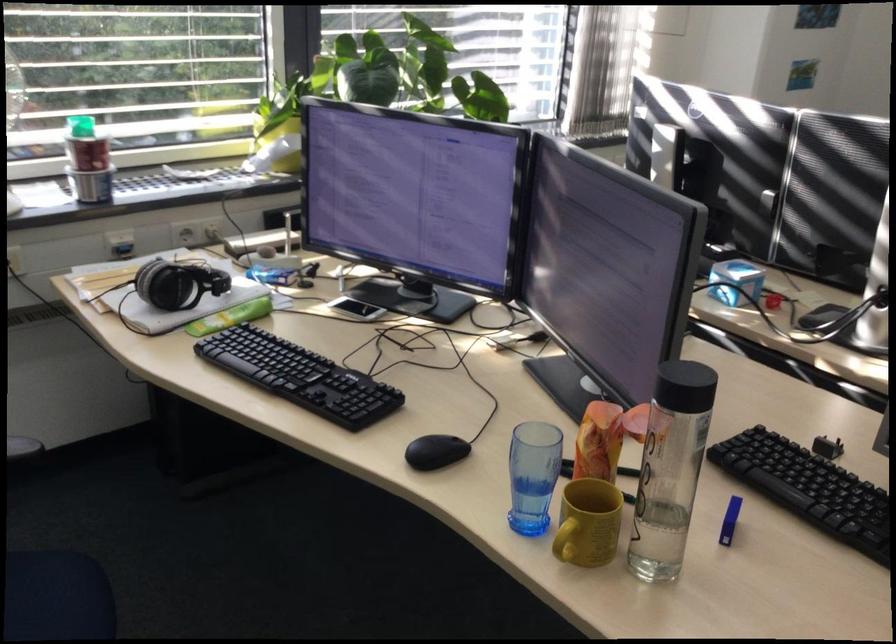
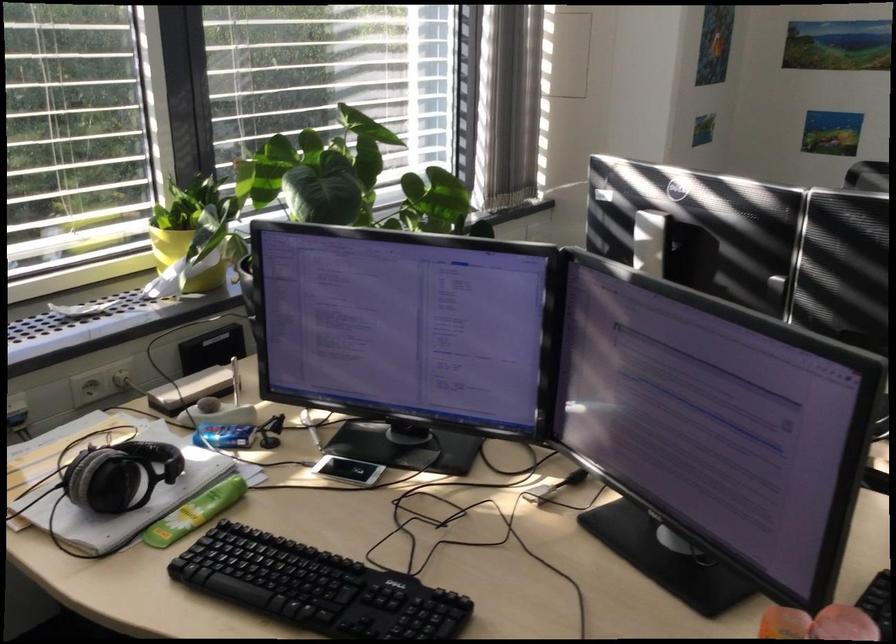
Question: The camera is either moving clockwise (left) or counter-clockwise (right) around the object. The first image is from the beginning of the video and the second image is from the end. Is the camera moving left or right when shooting the video?

Choices:
 (A) Left
 (B) Right

Answer: (A)